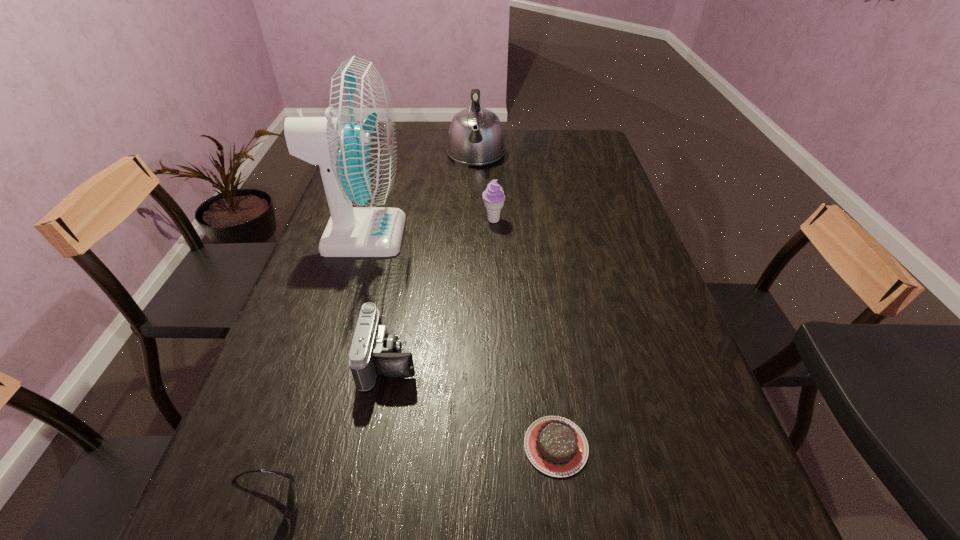
Locate an element on the screen. The height and width of the screenshot is (540, 960). fan is located at coordinates (355, 145).

This screenshot has height=540, width=960. In order to click on kettle in this screenshot , I will do `click(475, 137)`.

Find the location of `the farthest object`. the farthest object is located at coordinates (475, 137).

Locate an element on the screen. This screenshot has width=960, height=540. icecream is located at coordinates (493, 196).

In order to click on camera in this screenshot , I will do `click(374, 352)`.

At what (x,y) coordinates should I click in order to perform the action: click on the third nearest object. Please return your answer as a coordinate pair (x, y). Image resolution: width=960 pixels, height=540 pixels. Looking at the image, I should click on (374, 352).

Locate an element on the screen. chocolate cake is located at coordinates (556, 446).

Find the location of `vacant space situated 0.310m in front of the tallest object to face the airflow`. vacant space situated 0.310m in front of the tallest object to face the airflow is located at coordinates (513, 235).

In order to click on vacant space situated on the spout of the farthest object in this screenshot , I will do `click(475, 188)`.

Locate an element on the screen. free space located 0.250m on the right of the icecream is located at coordinates (588, 220).